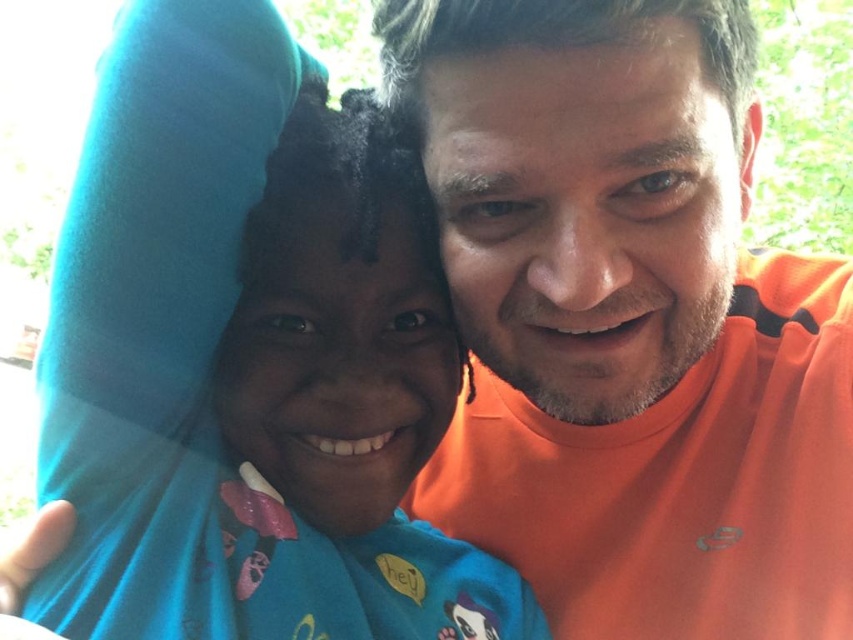
You are taking a photo of two people in a park. There are two points marked in the image at coordinates point (450, 516) and point (445, 564). If you want to focus on the point closer to the camera, which coordinate should you choose?

You should choose point (450, 516) because it is closer to the camera compared to point (445, 564).

You are a photographer trying to decide where to place a new decorative frame in the image. The frame needs to be placed between the orange cotton shirt at center and the blue fabric at left. Based on their heights, which object should the frame be closer to?

The orange cotton shirt at center is taller than the blue fabric at left, so the frame should be placed closer to the orange cotton shirt at center to maintain visual balance.

You are a photographer trying to focus on the orange cotton shirt at center and the blue fabric at left. Which object is closer to the camera?

The orange cotton shirt at center is closer to the camera than the blue fabric at left because it is positioned in front of it.